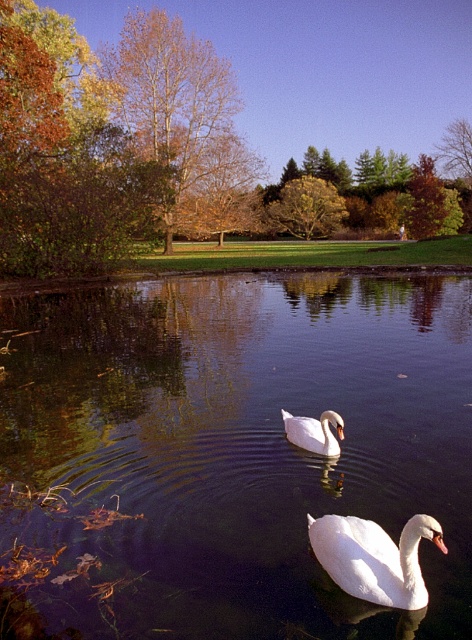
Which is more to the left, transparent water at center or white glossy swan at center?

Positioned to the left is white glossy swan at center.

Measure the distance between transparent water at center and white glossy swan at center.

A distance of 3.34 meters exists between transparent water at center and white glossy swan at center.

Which is in front, point (456, 346) or point (301, 445)?

Positioned in front is point (301, 445).

The height and width of the screenshot is (640, 472). Identify the location of transparent water at center. (228, 452).

Is point (440, 548) closer to viewer compared to point (297, 438)?

Yes, point (440, 548) is closer to viewer.

Can you confirm if white glossy swan at lower center is shorter than white glossy swan at center?

Incorrect, white glossy swan at lower center's height does not fall short of white glossy swan at center's.

Is point (409, 563) farther from camera compared to point (328, 456)?

No, it is not.

Find the location of a particular element. white glossy swan at lower center is located at coordinates (374, 557).

Between transparent water at center and white glossy swan at lower center, which one appears on the left side from the viewer's perspective?

white glossy swan at lower center is more to the left.

Locate an element on the screen. The image size is (472, 640). transparent water at center is located at coordinates (228, 452).